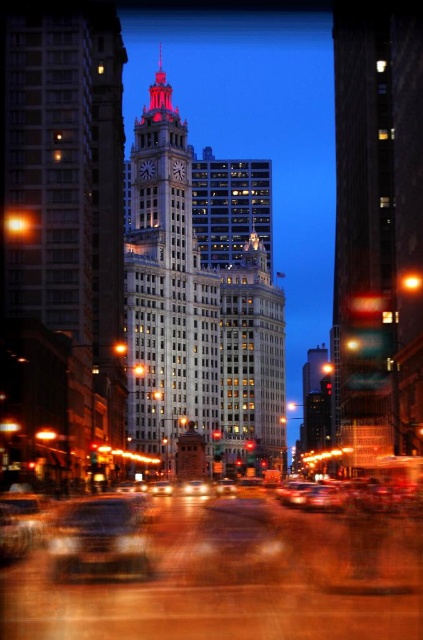
Question: Is white stone clock tower at center bigger than shiny silver car at center?

Choices:
 (A) yes
 (B) no

Answer: (A)

Question: Is white stone clock tower at center positioned at the back of shiny silver car at center?

Choices:
 (A) no
 (B) yes

Answer: (B)

Question: Among these points, which one is nearest to the camera?

Choices:
 (A) (126, 332)
 (B) (99, 532)

Answer: (B)

Question: Among these points, which one is farthest from the camera?

Choices:
 (A) click(173, 140)
 (B) click(90, 513)

Answer: (A)

Question: Is white stone clock tower at center bigger than shiny silver car at center?

Choices:
 (A) no
 (B) yes

Answer: (B)

Question: Among these points, which one is nearest to the camera?

Choices:
 (A) (263, 257)
 (B) (140, 545)

Answer: (B)